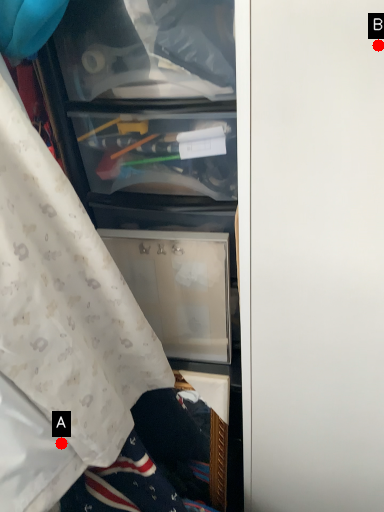
Question: Two points are circled on the image, labeled by A and B beside each circle. Which point is closer to the camera taking this photo?

Choices:
 (A) A is closer
 (B) B is closer

Answer: (B)